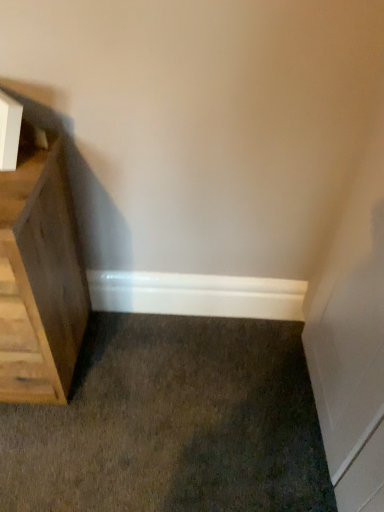
Question: Should I look upward or downward to see white smooth baseboard at lower center?

Choices:
 (A) up
 (B) down

Answer: (B)